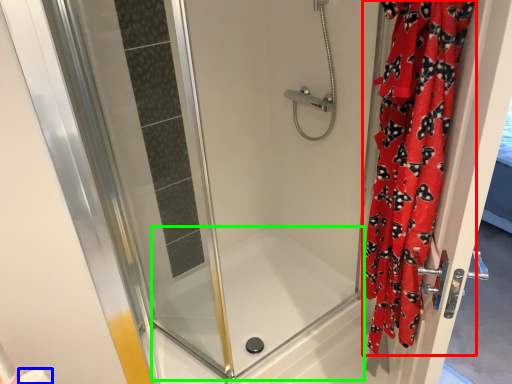
Question: Based on their relative distances, which object is farther from curtain (highlighted by a red box)? Choose from toilet paper (highlighted by a blue box) and bath (highlighted by a green box).

Choices:
 (A) toilet paper
 (B) bath

Answer: (A)